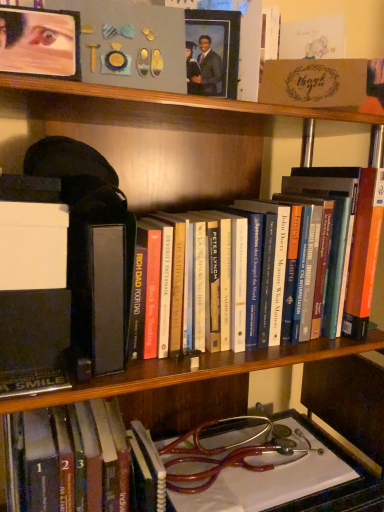
Question: Should I look upward or downward to see hardcover book at center, the second book when ordered from bottom to top?

Choices:
 (A) down
 (B) up

Answer: (B)

Question: Is hardcover book at center, the second book when ordered from bottom to top, turned away from hardcover book at center, the first book in the bottom-to-top sequence?

Choices:
 (A) no
 (B) yes

Answer: (A)

Question: Considering the relative sizes of hardcover book at center, the second book when ordered from bottom to top, and hardcover book at center, the first book in the bottom-to-top sequence, in the image provided, is hardcover book at center, the second book when ordered from bottom to top, wider than hardcover book at center, the first book in the bottom-to-top sequence,?

Choices:
 (A) no
 (B) yes

Answer: (A)

Question: From a real-world perspective, is hardcover book at center, the 1th book positioned from the top, positioned over hardcover book at center, positioned as the second book in top-to-bottom order, based on gravity?

Choices:
 (A) no
 (B) yes

Answer: (B)

Question: Can you confirm if hardcover book at center, the second book when ordered from bottom to top, is thinner than hardcover book at center, positioned as the second book in top-to-bottom order?

Choices:
 (A) no
 (B) yes

Answer: (B)

Question: From a real-world perspective, is hardcover book at center, the second book when ordered from bottom to top, positioned under hardcover book at center, the first book in the bottom-to-top sequence, based on gravity?

Choices:
 (A) no
 (B) yes

Answer: (A)

Question: Is hardcover book at center, the 1th book positioned from the top, touching matte black picture frame at upper center?

Choices:
 (A) yes
 (B) no

Answer: (B)

Question: Is hardcover book at center, the 1th book positioned from the top, in front of matte black picture frame at upper center?

Choices:
 (A) yes
 (B) no

Answer: (A)

Question: Is hardcover book at center, the second book when ordered from bottom to top, further to camera compared to matte black picture frame at upper center?

Choices:
 (A) yes
 (B) no

Answer: (B)

Question: Considering the relative positions of hardcover book at center, the 1th book positioned from the top, and matte black picture frame at upper center in the image provided, is hardcover book at center, the 1th book positioned from the top, to the left of matte black picture frame at upper center from the viewer's perspective?

Choices:
 (A) no
 (B) yes

Answer: (A)

Question: From the image's perspective, does hardcover book at center, the second book when ordered from bottom to top, appear higher than matte black picture frame at upper center?

Choices:
 (A) yes
 (B) no

Answer: (B)

Question: From a real-world perspective, does hardcover book at center, the second book when ordered from bottom to top, sit lower than matte black picture frame at upper center?

Choices:
 (A) yes
 (B) no

Answer: (A)

Question: From a real-world perspective, is matte black picture frame at upper center located beneath hardcover book at center, the first book in the bottom-to-top sequence?

Choices:
 (A) no
 (B) yes

Answer: (A)